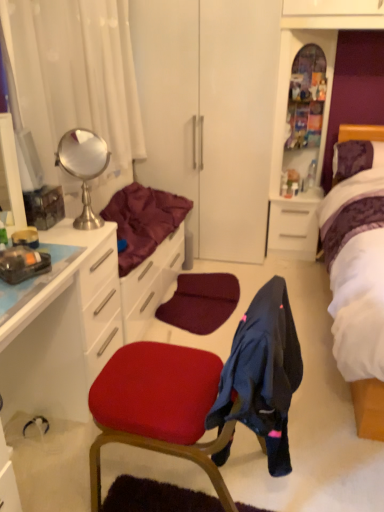
Question: Does translucent glass cabinet at upper center, positioned as the second file cabinet in bottom-to-top order, have a lesser height compared to white glossy file cabinet at center right, the 1th file cabinet from the bottom?

Choices:
 (A) no
 (B) yes

Answer: (A)

Question: From a real-world perspective, is translucent glass cabinet at upper center, positioned as the second file cabinet in bottom-to-top order, physically below white glossy file cabinet at center right, the 1th file cabinet from the bottom?

Choices:
 (A) no
 (B) yes

Answer: (A)

Question: Is translucent glass cabinet at upper center, positioned as the second file cabinet in bottom-to-top order, at the left side of white glossy file cabinet at center right, the 1th file cabinet from the bottom?

Choices:
 (A) yes
 (B) no

Answer: (A)

Question: Is translucent glass cabinet at upper center, placed as the 1th file cabinet when sorted from top to bottom, thinner than white glossy file cabinet at center right, the 1th file cabinet from the bottom?

Choices:
 (A) yes
 (B) no

Answer: (A)

Question: Is translucent glass cabinet at upper center, placed as the 1th file cabinet when sorted from top to bottom, in front of white glossy file cabinet at center right, the 2th file cabinet when ordered from top to bottom?

Choices:
 (A) no
 (B) yes

Answer: (B)

Question: Does translucent glass cabinet at upper center, positioned as the second file cabinet in bottom-to-top order, touch white glossy file cabinet at center right, the 2th file cabinet when ordered from top to bottom?

Choices:
 (A) yes
 (B) no

Answer: (B)

Question: From the image's perspective, does white glossy file cabinet at center right, the 1th file cabinet from the bottom, appear lower than matte red chair at center?

Choices:
 (A) no
 (B) yes

Answer: (A)

Question: Is white glossy file cabinet at center right, the 1th file cabinet from the bottom, further to the viewer compared to matte red chair at center?

Choices:
 (A) no
 (B) yes

Answer: (B)

Question: Considering the relative positions of white glossy file cabinet at center right, the 1th file cabinet from the bottom, and matte red chair at center in the image provided, is white glossy file cabinet at center right, the 1th file cabinet from the bottom, to the right of matte red chair at center from the viewer's perspective?

Choices:
 (A) no
 (B) yes

Answer: (B)

Question: From a real-world perspective, is white glossy file cabinet at center right, the 1th file cabinet from the bottom, physically above matte red chair at center?

Choices:
 (A) yes
 (B) no

Answer: (B)

Question: Can we say white glossy file cabinet at center right, the 2th file cabinet when ordered from top to bottom, lies outside matte red chair at center?

Choices:
 (A) yes
 (B) no

Answer: (A)

Question: Could you tell me if white glossy file cabinet at center right, the 2th file cabinet when ordered from top to bottom, is turned towards matte red chair at center?

Choices:
 (A) yes
 (B) no

Answer: (A)

Question: From a real-world perspective, is maroon fabric at left positioned over white glossy file cabinet at center right, the 2th file cabinet when ordered from top to bottom, based on gravity?

Choices:
 (A) no
 (B) yes

Answer: (B)